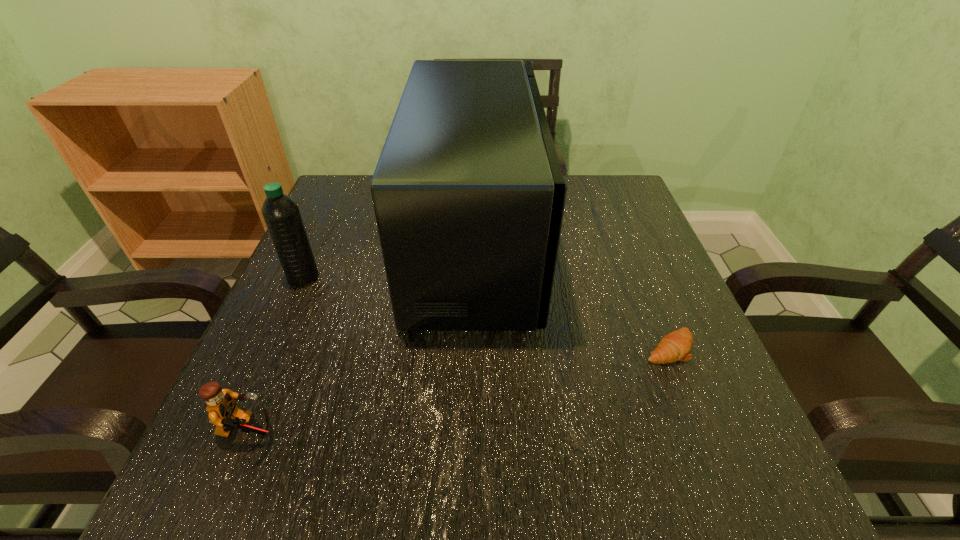
Find the location of a particular element. free point located 0.310m on the left of the rightmost object is located at coordinates (469, 348).

I want to click on object located at the far edge, so click(468, 193).

This screenshot has width=960, height=540. What are the coordinates of `object at the near edge` in the screenshot? It's located at (224, 413).

Identify the location of water bottle at the left edge. (281, 214).

This screenshot has height=540, width=960. Find the location of `Lego at the left edge`. Lego at the left edge is located at coordinates (224, 413).

Locate an element on the screen. object located in the right edge section of the desktop is located at coordinates (675, 346).

Where is `object that is at the near left corner`? object that is at the near left corner is located at coordinates (224, 413).

Find the location of `blank area at the near edge`. blank area at the near edge is located at coordinates (651, 496).

The height and width of the screenshot is (540, 960). I want to click on free space at the left edge, so click(x=240, y=443).

This screenshot has height=540, width=960. Identify the location of vacant space at the right edge of the desktop. (649, 312).